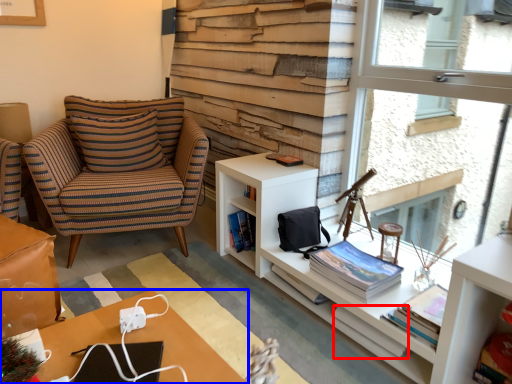
Question: Which point is closer to the camera, book (highlighted by a red box) or desk (highlighted by a blue box)?

Choices:
 (A) book
 (B) desk

Answer: (B)